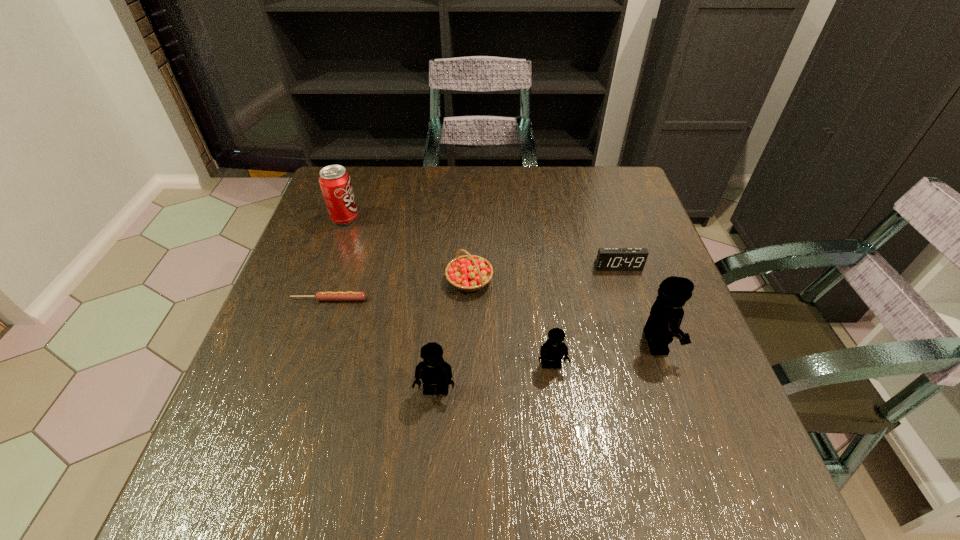
Please point out where to position a new Lego on the left to maintain spacing. Please provide its 2D coordinates. Your answer should be formatted as a tuple, i.e. [(x, y)], where the tuple contains the x and y coordinates of a point satisfying the conditions above.

[(309, 417)]